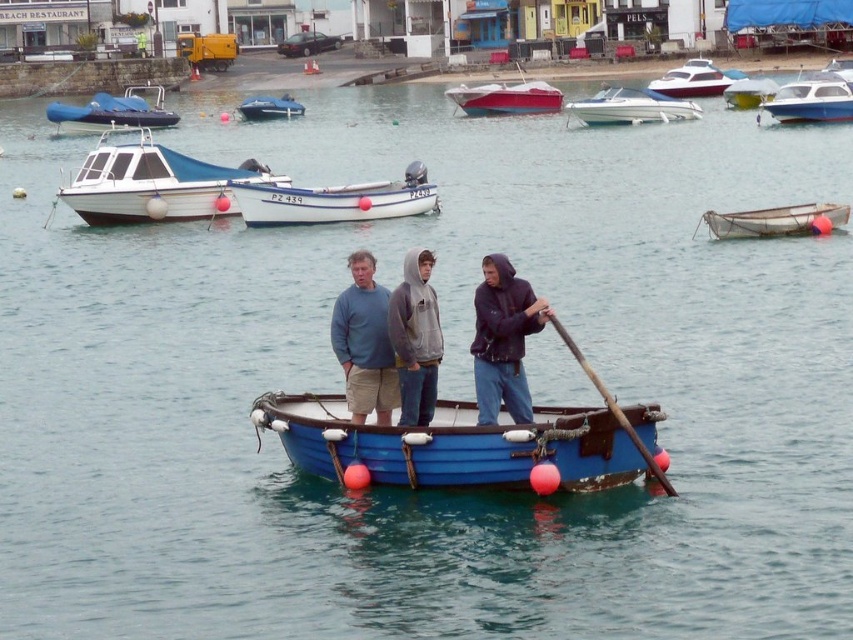
Question: In this image, where is matte blue sweater at center located relative to white glossy speedboat at upper center?

Choices:
 (A) left
 (B) right

Answer: (A)

Question: Observing the image, what is the correct spatial positioning of white plastic boat at center in reference to white glossy motorboat at upper center?

Choices:
 (A) below
 (B) above

Answer: (A)

Question: Which of the following is the farthest from the observer?

Choices:
 (A) white polished wood boat at upper left
 (B) blue rubber dinghy at upper left
 (C) white glossy boat at upper right

Answer: (B)

Question: Is dark blue hooded sweatshirt at center bigger than blue fabric boat at center?

Choices:
 (A) no
 (B) yes

Answer: (B)

Question: Based on their relative distances, which object is nearer to the wooden at center?

Choices:
 (A) white glossy speedboat at upper center
 (B) yellow matte boat at center

Answer: (A)

Question: Which point is closer to the camera taking this photo?

Choices:
 (A) (97, 106)
 (B) (357, 296)
 (C) (518, 84)
 (D) (608, 397)

Answer: (D)